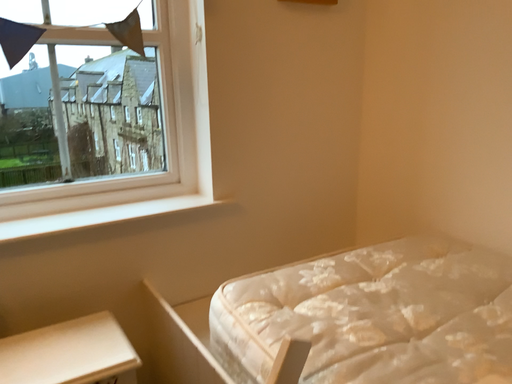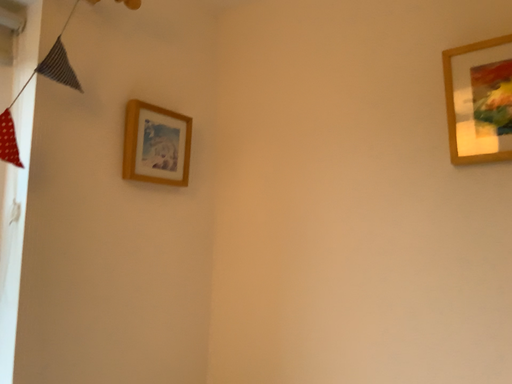
Question: How did the camera likely rotate when shooting the video?

Choices:
 (A) rotated right
 (B) rotated left

Answer: (A)